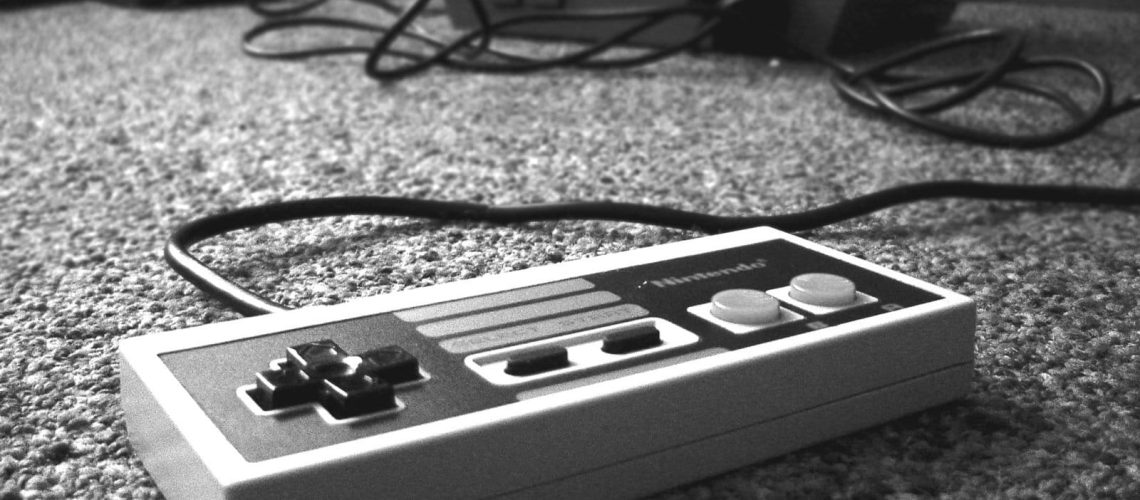
I want to click on game controller, so click(x=477, y=426).